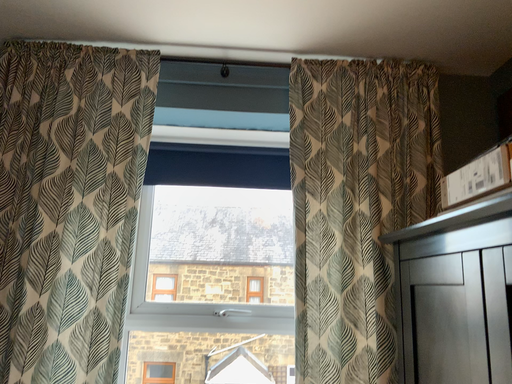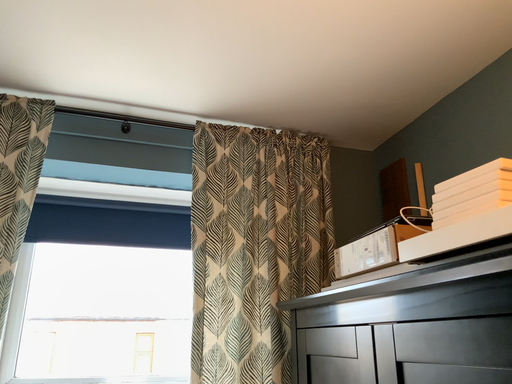
Question: How did the camera likely rotate when shooting the video?

Choices:
 (A) rotated left
 (B) rotated right

Answer: (B)